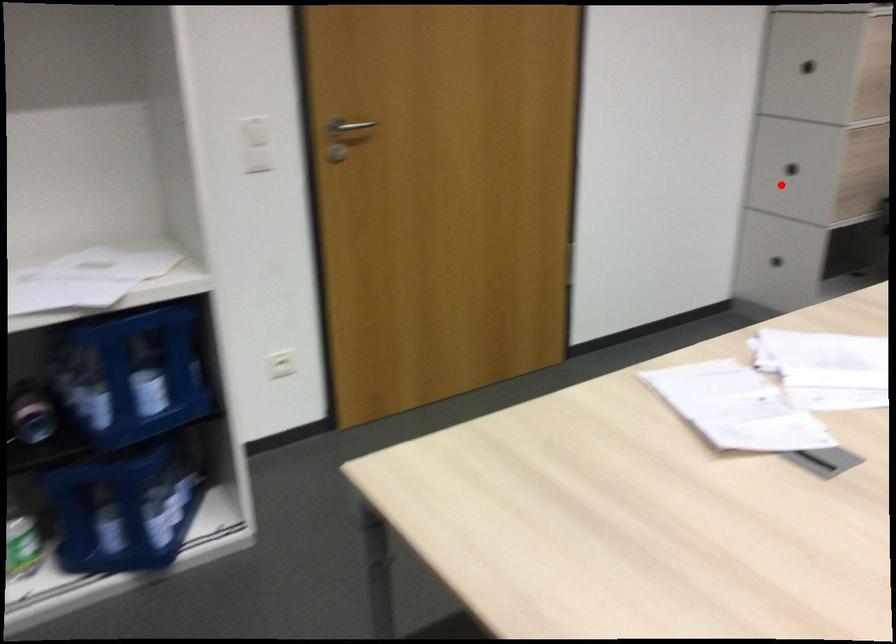
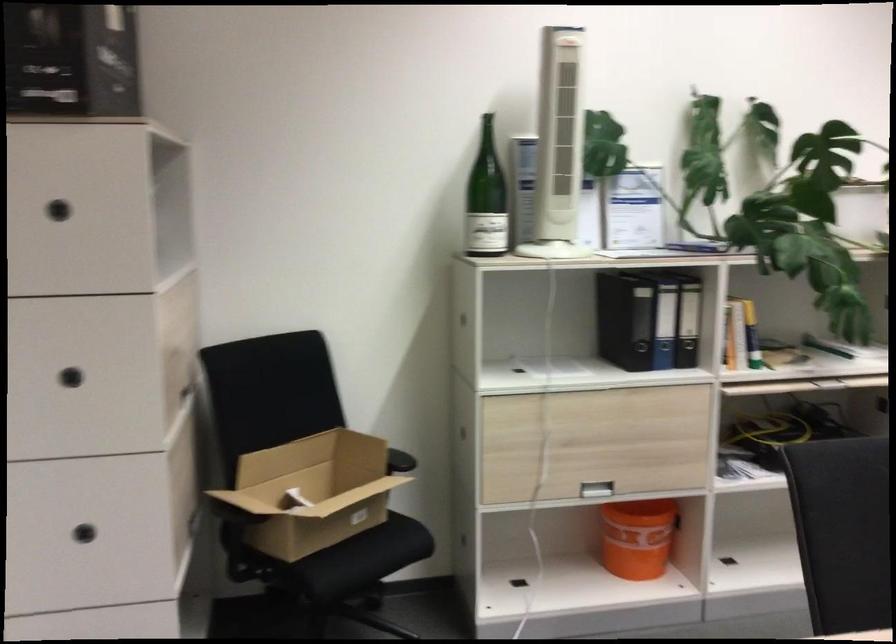
Find the pixel in the second image that matches the highlighted location in the first image.

(85, 554)